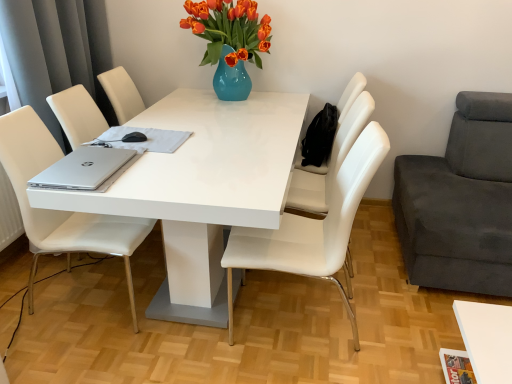
Question: From the image's perspective, is white cloth at center under silver metallic laptop at left?

Choices:
 (A) yes
 (B) no

Answer: (B)

Question: Is silver metallic laptop at left surrounded by white cloth at center?

Choices:
 (A) yes
 (B) no

Answer: (B)

Question: Is white cloth at center further to the viewer compared to silver metallic laptop at left?

Choices:
 (A) no
 (B) yes

Answer: (B)

Question: From the image's perspective, would you say white cloth at center is positioned over silver metallic laptop at left?

Choices:
 (A) yes
 (B) no

Answer: (A)

Question: Is white cloth at center not within silver metallic laptop at left?

Choices:
 (A) no
 (B) yes

Answer: (B)

Question: Considering their positions, is silver metallic laptop at left located in front of or behind dark gray fabric couch at right, which is the 1th chair from right to left?

Choices:
 (A) behind
 (B) front

Answer: (A)

Question: From their relative heights in the image, would you say silver metallic laptop at left is taller or shorter than dark gray fabric couch at right, the fourth chair in the left-to-right sequence?

Choices:
 (A) short
 (B) tall

Answer: (A)

Question: From a real-world perspective, is silver metallic laptop at left physically located above or below dark gray fabric couch at right, the fourth chair in the left-to-right sequence?

Choices:
 (A) below
 (B) above

Answer: (B)

Question: Considering the positions of point (82, 150) and point (425, 213), is point (82, 150) closer or farther from the camera than point (425, 213)?

Choices:
 (A) farther
 (B) closer

Answer: (B)

Question: Considering the positions of white cloth at center and dark gray fabric couch at right, which is the 1th chair from right to left, in the image, is white cloth at center wider or thinner than dark gray fabric couch at right, which is the 1th chair from right to left,?

Choices:
 (A) wide
 (B) thin

Answer: (B)

Question: In the image, is white cloth at center positioned in front of or behind dark gray fabric couch at right, which is the 1th chair from right to left?

Choices:
 (A) behind
 (B) front

Answer: (A)

Question: From a real-world perspective, is white cloth at center positioned above or below dark gray fabric couch at right, which is the 1th chair from right to left?

Choices:
 (A) above
 (B) below

Answer: (A)

Question: In terms of height, does white cloth at center look taller or shorter compared to dark gray fabric couch at right, the fourth chair in the left-to-right sequence?

Choices:
 (A) tall
 (B) short

Answer: (B)

Question: Does point (153, 206) appear closer or farther from the camera than point (308, 183)?

Choices:
 (A) closer
 (B) farther

Answer: (A)

Question: From a real-world perspective, is white glossy table at center physically located above or below white leather chair at center, placed as the 2th chair when sorted from right to left?

Choices:
 (A) above
 (B) below

Answer: (B)